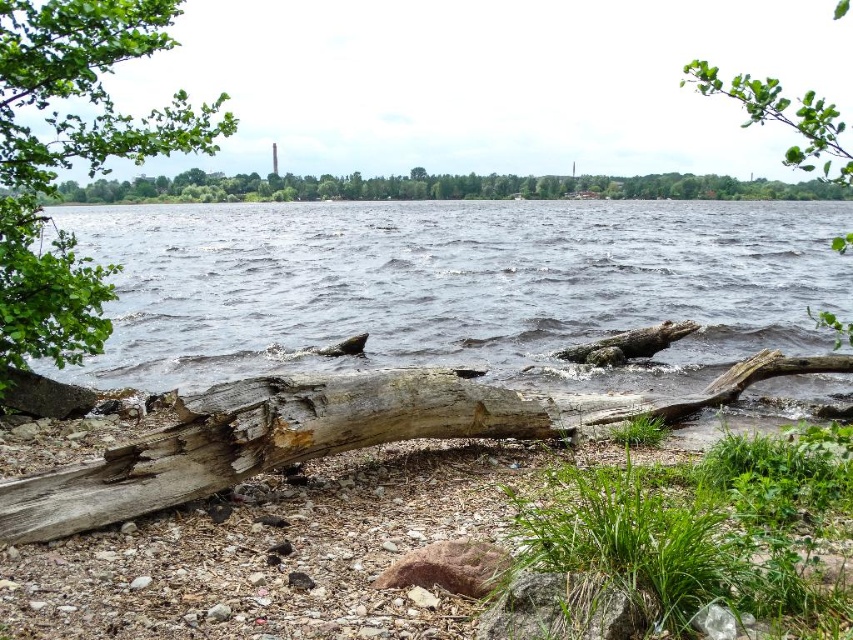
You are standing on the lakeshore and want to take a photo of the dark blue water at center and the green leafy tree at upper left. Based on their positions, which object should you focus on first to ensure both are in the frame?

The dark blue water at center is above the green leafy tree at upper left, so you should focus on the green leafy tree at upper left first to ensure both are in the frame.

You are standing on the lakeshore and want to take a photo of both the dark blue water at center and the green leafy tree at upper left. Which object should you focus on first to ensure both are in clear view?

You should focus on the green leafy tree at upper left first because it is closer to you than the dark blue water at center, which is further away. This way, both objects will be in clear view.

You are standing at the lakeside and want to pick up litter. There are two points marked in the scene. Which point, point (660, 273) or point (241, 188), is closer to you?

Point (660, 273) is closer to you than point (241, 188).